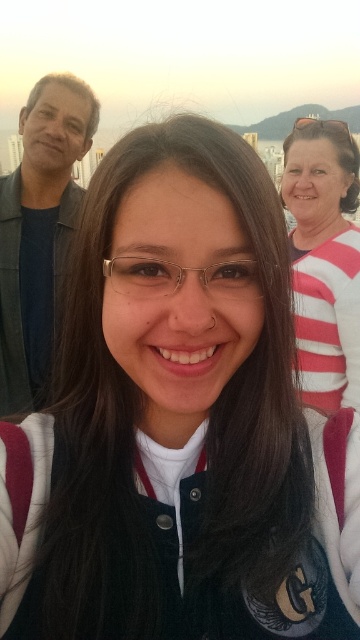
Question: Which of these objects is positioned closest to the clear plastic glasses at upper center?

Choices:
 (A) white striped sweater at upper right
 (B) clear plastic glasses at center
 (C) matte black jacket at left

Answer: (A)

Question: Based on their relative distances, which object is farther from the clear plastic glasses at center?

Choices:
 (A) white striped sweater at upper right
 (B) clear plastic glasses at upper center

Answer: (B)

Question: Which point is closer to the camera?

Choices:
 (A) (329, 305)
 (B) (141, 268)

Answer: (B)

Question: Is matte black jacket at left below clear plastic glasses at center?

Choices:
 (A) yes
 (B) no

Answer: (B)

Question: Does white striped sweater at upper right come in front of clear plastic glasses at upper center?

Choices:
 (A) no
 (B) yes

Answer: (B)

Question: Is clear plastic glasses at center thinner than clear plastic glasses at upper center?

Choices:
 (A) no
 (B) yes

Answer: (A)